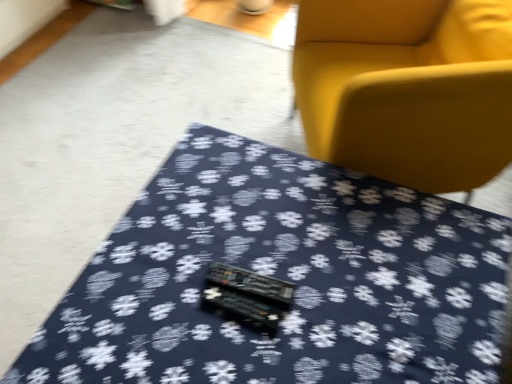
Locate an element on the screen. This screenshot has width=512, height=384. vacant area on top of dark blue fabric at center (from a real-world perspective) is located at coordinates (289, 261).